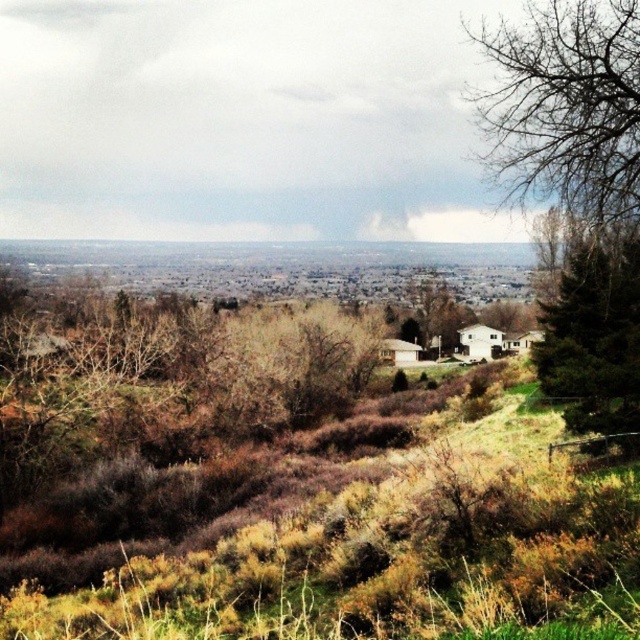
Question: Which object appears closest to the camera in this image?

Choices:
 (A) green textured pine tree at right
 (B) brown dry grass at lower center

Answer: (B)

Question: Which of the following is the closest to the observer?

Choices:
 (A) (556, 385)
 (B) (273, 593)

Answer: (B)

Question: Can you confirm if brown dry grass at lower center is positioned to the right of green textured pine tree at right?

Choices:
 (A) no
 (B) yes

Answer: (A)

Question: Is brown dry grass at lower center thinner than green textured pine tree at right?

Choices:
 (A) yes
 (B) no

Answer: (B)

Question: Does brown dry grass at lower center appear under green textured pine tree at right?

Choices:
 (A) yes
 (B) no

Answer: (A)

Question: Which point is farther from the camera taking this photo?

Choices:
 (A) (637, 262)
 (B) (608, 497)

Answer: (A)